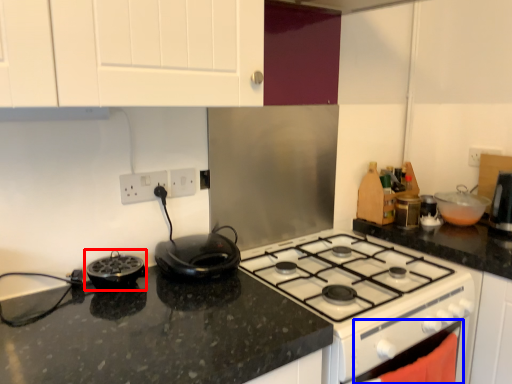
Question: Which object appears closest to the camera in this image, kitchen appliance (highlighted by a red box) or oven (highlighted by a blue box)?

Choices:
 (A) kitchen appliance
 (B) oven

Answer: (B)